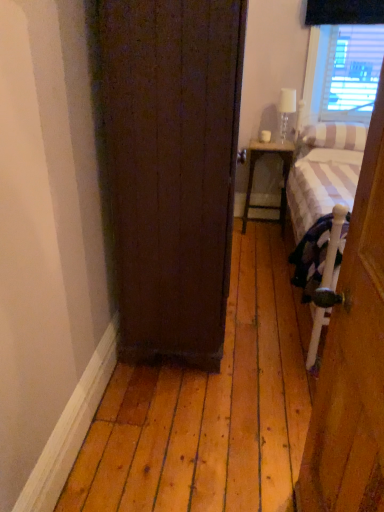
The width and height of the screenshot is (384, 512). Describe the element at coordinates (335, 136) in the screenshot. I see `white striped pillow at right, placed as the second pillow when sorted from bottom to top` at that location.

What is the approximate width of wooden door at right, the first door viewed from the front?

wooden door at right, the first door viewed from the front, is 8.15 inches wide.

What do you see at coordinates (285, 110) in the screenshot? This screenshot has width=384, height=512. I see `clear glass lamp at upper right` at bounding box center [285, 110].

In order to face white striped pillow at right, which is the second pillow in top-to-bottom order, should I rotate leftwards or rightwards?

A 18.530 degree turn to the right will do.

You are a GUI agent. You are given a task and a screenshot of the screen. Output one action in this format:
    pyautogui.click(x=<x>, y=<y>)
    Task: Click on the white striped pillow at right, placed as the second pillow when sorted from bottom to top
    Image resolution: width=384 pixels, height=512 pixels.
    Given the screenshot: What is the action you would take?
    pyautogui.click(x=335, y=136)

Does dark wood door at center, arranged as the second door when viewed from the front, have a greater height compared to clear glass lamp at upper right?

Correct, dark wood door at center, arranged as the second door when viewed from the front, is much taller as clear glass lamp at upper right.

Would you say dark wood door at center, the 1th door in the back-to-front sequence, contains clear glass lamp at upper right?

That's incorrect, clear glass lamp at upper right is not inside dark wood door at center, the 1th door in the back-to-front sequence.

At what (x,y) coordinates should I click in order to perform the action: click on the 1st door located beneath the clear glass lamp at upper right (from a real-world perspective). Please return your answer as a coordinate pair (x, y). The image size is (384, 512). Looking at the image, I should click on (171, 169).

Can you confirm if dark wood door at center, which is the 2th door from right to left, is wider than clear glass lamp at upper right?

Yes, dark wood door at center, which is the 2th door from right to left, is wider than clear glass lamp at upper right.

You are a GUI agent. You are given a task and a screenshot of the screen. Output one action in this format:
    pyautogui.click(x=<x>, y=<y>)
    Task: Click on the 2nd pillow to the right when counting from the clear glass lamp at upper right
    
    Given the screenshot: What is the action you would take?
    pyautogui.click(x=335, y=136)

Which point is more distant from viewer, (283, 92) or (315, 129)?

The point (283, 92) is behind.

Is clear glass lamp at upper right aimed at white striped pillow at right, placed as the second pillow when sorted from bottom to top?

No, clear glass lamp at upper right is not aimed at white striped pillow at right, placed as the second pillow when sorted from bottom to top.

Identify the location of lamp above the white striped fabric bed at right (from the image's perspective). (285, 110).

How different are the orientations of clear glass lamp at upper right and white striped fabric bed at right in degrees?

The angular difference between clear glass lamp at upper right and white striped fabric bed at right is 1.37 degrees.

Is clear glass lamp at upper right in front of or behind white striped fabric bed at right in the image?

In the image, clear glass lamp at upper right appears behind white striped fabric bed at right.

Is clear glass lamp at upper right to the left or to the right of white striped fabric bed at right in the image?

From the image, it's evident that clear glass lamp at upper right is to the left of white striped fabric bed at right.

Between point (345, 154) and point (321, 129), which one is positioned behind?

The point (321, 129) is behind.

From the white striped fabric bed at right, count 1st pillow to the right and point to it. Please provide its 2D coordinates.

[(333, 156)]

From a real-world perspective, between white striped pillow at right, which is the second pillow in top-to-bottom order, and white striped fabric bed at right, who is vertically higher?

From a 3D spatial view, white striped pillow at right, which is the second pillow in top-to-bottom order, is above.

Could you tell me if white striped pillow at right, which is the second pillow in top-to-bottom order, is turned towards white striped fabric bed at right?

Yes, white striped pillow at right, which is the second pillow in top-to-bottom order, is turned towards white striped fabric bed at right.

What's the angular difference between wooden door at right, which appears as the 2th door when viewed from the left, and dark wood door at center, placed as the 1th door when sorted from left to right,'s facing directions?

177 degrees separate the facing orientations of wooden door at right, which appears as the 2th door when viewed from the left, and dark wood door at center, placed as the 1th door when sorted from left to right.

Considering the sizes of objects wooden door at right, the 2th door in the back-to-front sequence, and dark wood door at center, the 1th door in the back-to-front sequence, in the image provided, who is smaller, wooden door at right, the 2th door in the back-to-front sequence, or dark wood door at center, the 1th door in the back-to-front sequence,?

wooden door at right, the 2th door in the back-to-front sequence, is smaller.

Is wooden door at right, which appears as the 2th door when viewed from the left, far from dark wood door at center, arranged as the second door when viewed from the front?

wooden door at right, which appears as the 2th door when viewed from the left, is near dark wood door at center, arranged as the second door when viewed from the front, not far away.

I want to click on door beneath the dark wood door at center, the 1th door in the back-to-front sequence (from a real-world perspective), so click(x=353, y=360).

Choose the correct answer: Is matte white wood nightstand at center inside dark wood door at center, arranged as the second door when viewed from the front, or outside it?

The correct answer is: outside.

From a real-world perspective, does matte white wood nightstand at center sit lower than dark wood door at center, arranged as the second door when viewed from the front?

Yes, from a real-world perspective, matte white wood nightstand at center is under dark wood door at center, arranged as the second door when viewed from the front.

Who is smaller, matte white wood nightstand at center or dark wood door at center, which is the 2th door from right to left?

matte white wood nightstand at center.

From a real-world perspective, relative to wooden door at right, positioned as the 1th door in right-to-left order, is matte white wood nightstand at center vertically above or below?

In terms of real-world spatial position, matte white wood nightstand at center is below wooden door at right, positioned as the 1th door in right-to-left order.

Is matte white wood nightstand at center spatially inside wooden door at right, positioned as the 1th door in right-to-left order, or outside of it?

matte white wood nightstand at center is not enclosed by wooden door at right, positioned as the 1th door in right-to-left order.

You are a GUI agent. You are given a task and a screenshot of the screen. Output one action in this format:
    pyautogui.click(x=<x>, y=<y>)
    Task: Click on the lamp on the right side of dark wood door at center, which is the 2th door from right to left
    
    Given the screenshot: What is the action you would take?
    pyautogui.click(x=285, y=110)

Find the location of a particular element. The image size is (384, 512). lamp behind the white striped pillow at right, placed as the second pillow when sorted from bottom to top is located at coordinates (285, 110).

Looking at the image, which one is located further to matte white wood nightstand at center, white striped pillow at right, which is the first pillow from bottom to top, or wooden door at right, positioned as the 1th door in right-to-left order?

wooden door at right, positioned as the 1th door in right-to-left order, lies further to matte white wood nightstand at center than the other object.

Looking at the image, which one is located closer to white striped pillow at right, which is the first pillow from bottom to top, white striped pillow at right, placed as the second pillow when sorted from bottom to top, or matte white wood nightstand at center?

white striped pillow at right, placed as the second pillow when sorted from bottom to top, is positioned closer to the anchor white striped pillow at right, which is the first pillow from bottom to top.

Which object lies further to the anchor point white striped pillow at right, which is the first pillow from bottom to top, matte white wood nightstand at center or dark wood door at center, arranged as the second door when viewed from the front?

Among the two, dark wood door at center, arranged as the second door when viewed from the front, is located further to white striped pillow at right, which is the first pillow from bottom to top.

Which object lies further to the anchor point white striped pillow at right, the 1th pillow when ordered from top to bottom, white striped pillow at right, which is the second pillow in top-to-bottom order, or white striped fabric bed at right?

The object further to white striped pillow at right, the 1th pillow when ordered from top to bottom, is white striped fabric bed at right.

Estimate the real-world distances between objects in this image. Which object is closer to matte white wood nightstand at center, white striped pillow at right, placed as the second pillow when sorted from bottom to top, or clear glass lamp at upper right?

Based on the image, clear glass lamp at upper right appears to be nearer to matte white wood nightstand at center.

Estimate the real-world distances between objects in this image. Which object is closer to dark wood door at center, placed as the 1th door when sorted from left to right, wooden door at right, which appears as the 2th door when viewed from the left, or clear glass lamp at upper right?

The object closer to dark wood door at center, placed as the 1th door when sorted from left to right, is wooden door at right, which appears as the 2th door when viewed from the left.

Based on their spatial positions, is white striped pillow at right, which is the second pillow in top-to-bottom order, or matte white wood nightstand at center further from clear glass lamp at upper right?

white striped pillow at right, which is the second pillow in top-to-bottom order, is further to clear glass lamp at upper right.

Which object lies nearer to the anchor point matte white wood nightstand at center, clear glass lamp at upper right or wooden door at right, the 2th door in the back-to-front sequence?

Based on the image, clear glass lamp at upper right appears to be nearer to matte white wood nightstand at center.

Image resolution: width=384 pixels, height=512 pixels. In order to click on bed between wooden door at right, positioned as the 1th door in right-to-left order, and clear glass lamp at upper right from front to back in this screenshot , I will do `click(323, 211)`.

This screenshot has width=384, height=512. What are the coordinates of `door located between wooden door at right, the 2th door in the back-to-front sequence, and white striped pillow at right, which is the first pillow from bottom to top, in the depth direction` in the screenshot? It's located at (171, 169).

The image size is (384, 512). I want to click on lamp between dark wood door at center, the 1th door in the back-to-front sequence, and matte white wood nightstand at center from front to back, so click(x=285, y=110).

Find the location of a particular element. Image resolution: width=384 pixels, height=512 pixels. bed positioned between dark wood door at center, which is the 2th door from right to left, and matte white wood nightstand at center from near to far is located at coordinates (323, 211).